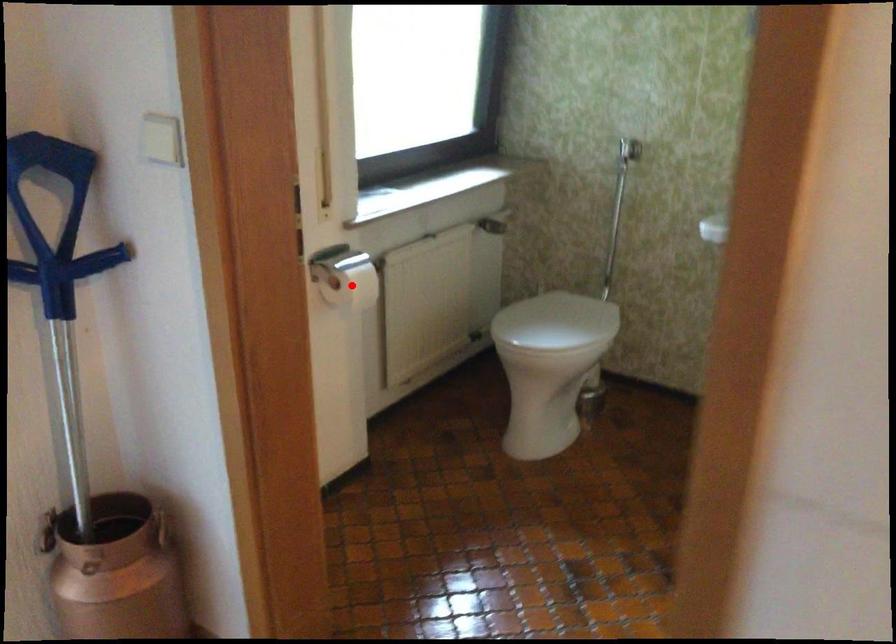
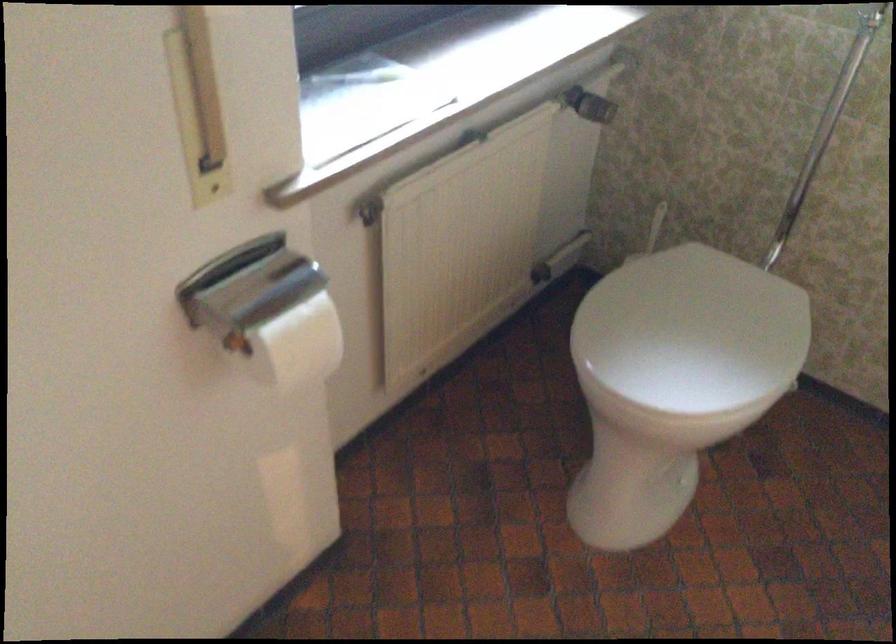
Question: I am providing you with two images of the same scene from different viewpoints. Given a red point in image1, look at the same physical point in image2. Is it:

Choices:
 (A) Closer to the viewpoint
 (B) Farther from the viewpoint

Answer: (A)